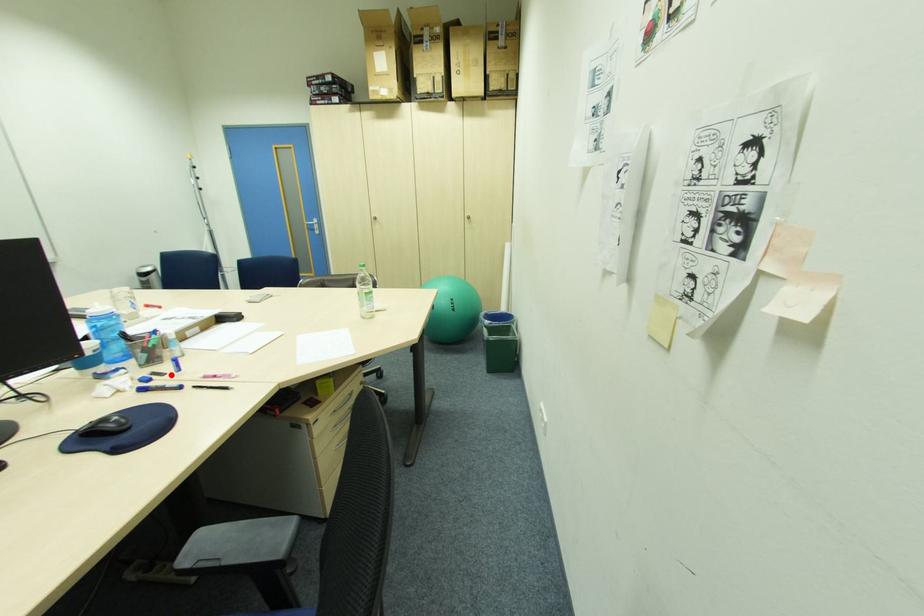
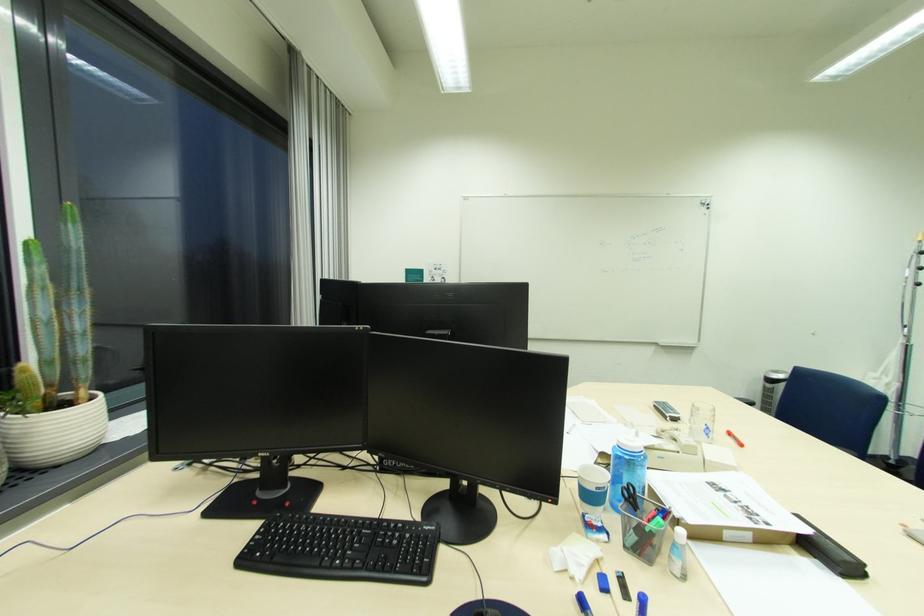
Where in the second image is the point corresponding to the highlighted location from the first image?

(636, 601)